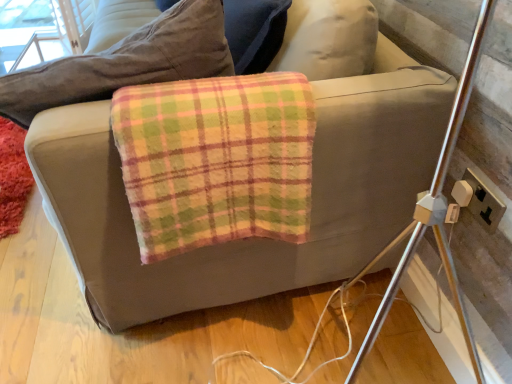
Question: Does fluffy red mat at lower left lie in front of gold plastic electrical outlet at right?

Choices:
 (A) no
 (B) yes

Answer: (A)

Question: Is gold plastic electrical outlet at right inside fluffy red mat at lower left?

Choices:
 (A) no
 (B) yes

Answer: (A)

Question: Is fluffy red mat at lower left bigger than gold plastic electrical outlet at right?

Choices:
 (A) no
 (B) yes

Answer: (B)

Question: Considering the relative sizes of fluffy red mat at lower left and gold plastic electrical outlet at right in the image provided, is fluffy red mat at lower left smaller than gold plastic electrical outlet at right?

Choices:
 (A) yes
 (B) no

Answer: (B)

Question: Considering the relative positions of fluffy red mat at lower left and gold plastic electrical outlet at right in the image provided, is fluffy red mat at lower left to the left of gold plastic electrical outlet at right from the viewer's perspective?

Choices:
 (A) yes
 (B) no

Answer: (A)

Question: Is fluffy red mat at lower left positioned behind gold plastic electrical outlet at right?

Choices:
 (A) no
 (B) yes

Answer: (B)

Question: Does gold plastic electrical outlet at right turn towards fluffy red mat at lower left?

Choices:
 (A) no
 (B) yes

Answer: (A)

Question: Is gold plastic electrical outlet at right smaller than fluffy red mat at lower left?

Choices:
 (A) yes
 (B) no

Answer: (A)

Question: Considering the relative positions of gold plastic electrical outlet at right and fluffy red mat at lower left in the image provided, is gold plastic electrical outlet at right to the left of fluffy red mat at lower left from the viewer's perspective?

Choices:
 (A) no
 (B) yes

Answer: (A)

Question: Considering the relative sizes of gold plastic electrical outlet at right and fluffy red mat at lower left in the image provided, is gold plastic electrical outlet at right bigger than fluffy red mat at lower left?

Choices:
 (A) yes
 (B) no

Answer: (B)

Question: Can you confirm if gold plastic electrical outlet at right is taller than fluffy red mat at lower left?

Choices:
 (A) yes
 (B) no

Answer: (A)

Question: Is gold plastic electrical outlet at right positioned behind fluffy red mat at lower left?

Choices:
 (A) no
 (B) yes

Answer: (A)

Question: Considering the relative sizes of plaid fleece blanket at center and fluffy red mat at lower left in the image provided, is plaid fleece blanket at center wider than fluffy red mat at lower left?

Choices:
 (A) yes
 (B) no

Answer: (A)